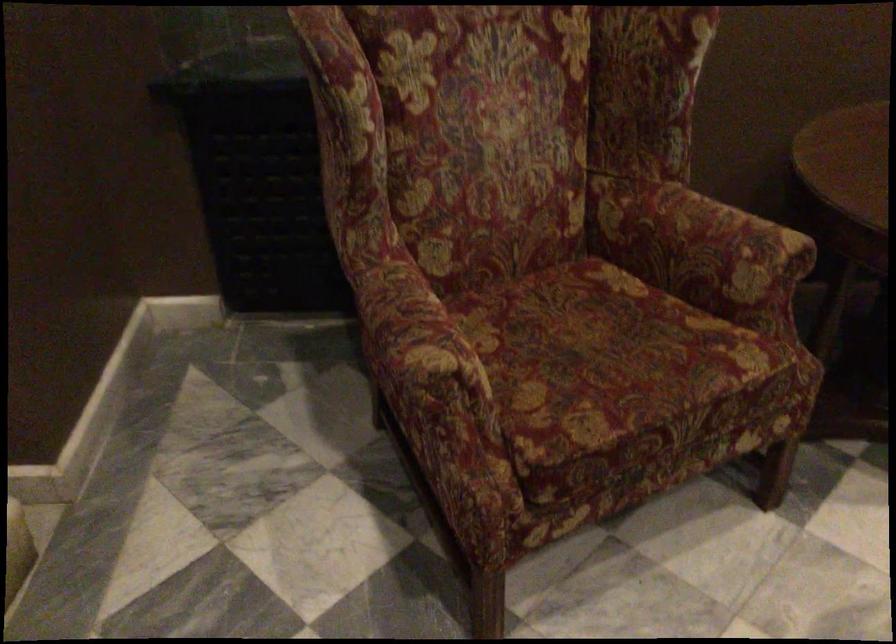
Where would you sit the patterned chair sitting surface? Please return your answer as a coordinate pair (x, y).

(606, 361)